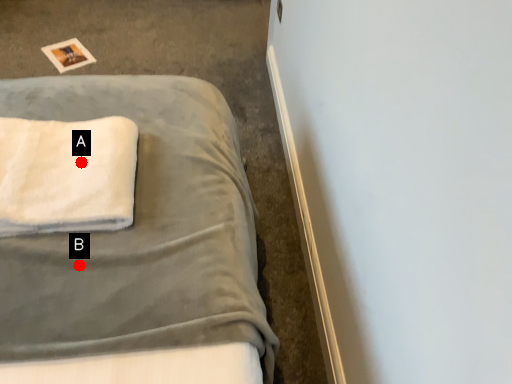
Question: Two points are circled on the image, labeled by A and B beside each circle. Among these points, which one is farthest from the camera?

Choices:
 (A) A is further
 (B) B is further

Answer: (A)